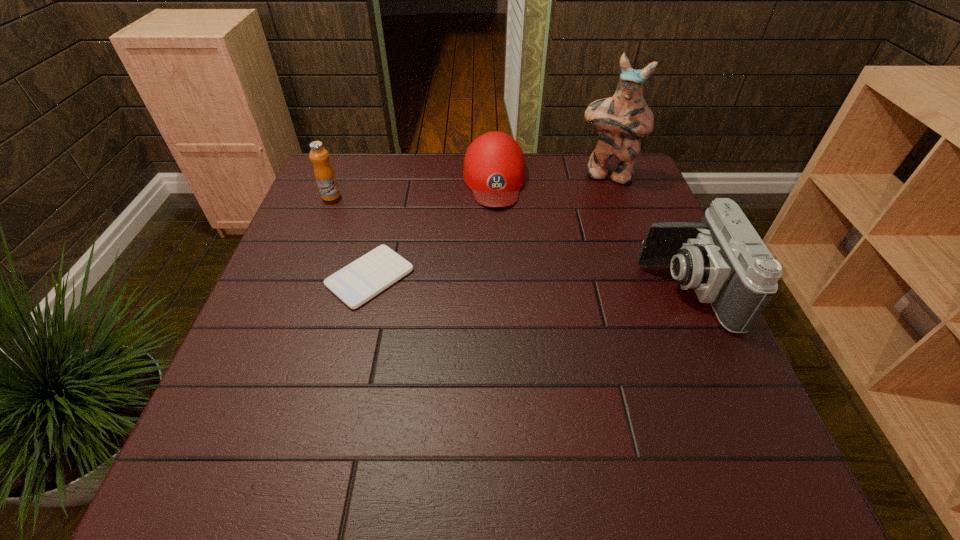
The image size is (960, 540). I want to click on orange juice that is at the far edge, so click(325, 177).

Identify the location of baseball cap located at the far edge. The height and width of the screenshot is (540, 960). (494, 169).

In order to click on figurine that is at the far edge in this screenshot , I will do `click(622, 120)`.

This screenshot has height=540, width=960. Find the location of `calculator present at the left edge`. calculator present at the left edge is located at coordinates (355, 284).

Identify the location of orange juice present at the left edge. This screenshot has width=960, height=540. (325, 177).

Where is `camera at the right edge`? This screenshot has height=540, width=960. camera at the right edge is located at coordinates (723, 258).

Find the location of a particular element. The image size is (960, 540). figurine that is at the right edge is located at coordinates (622, 120).

Identify the location of object present at the far left corner. The image size is (960, 540). (325, 177).

At what (x,y) coordinates should I click in order to perform the action: click on object located at the far right corner. Please return your answer as a coordinate pair (x, y). This screenshot has height=540, width=960. Looking at the image, I should click on (622, 120).

Locate an element on the screen. Image resolution: width=960 pixels, height=540 pixels. free space at the far edge of the desktop is located at coordinates (422, 165).